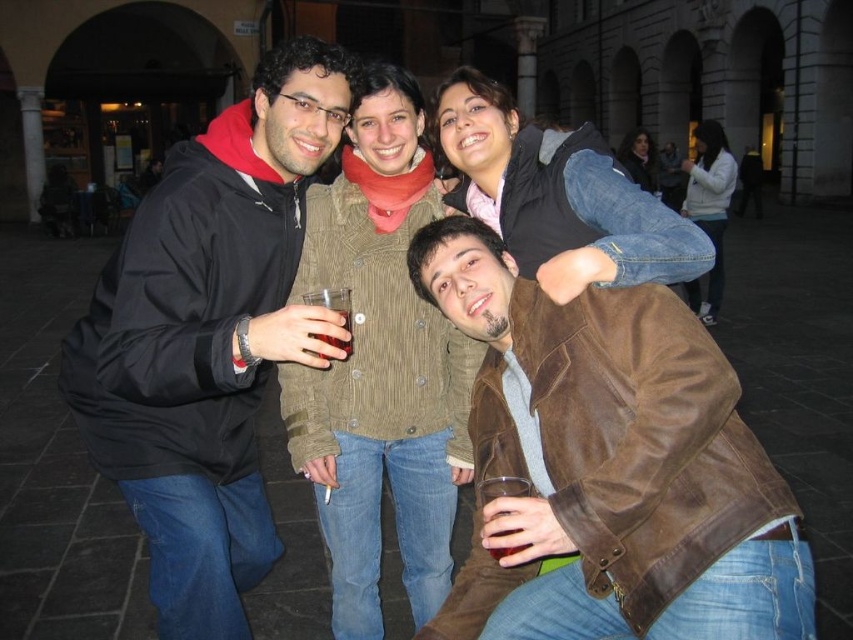
You are a photographer trying to capture the group photo. You notice the brown suede jacket at lower right and the translucent glass at center. Which object should you focus on first if you want to ensure both are in focus, considering their sizes?

The brown suede jacket at lower right is bigger than the translucent glass at center, so focusing on the larger object first will help ensure both are in focus.

You are standing at the center of the plaza and want to hand a gift to both the person wearing the brown suede jacket at lower right and the person wearing the black jacket at left. Which jacket is lower in position?

The brown suede jacket at lower right is below the black jacket at left, so the brown suede jacket at lower right is lower in position.

Looking at this image, you are standing at the center of the square and want to find the black jacket at left. Which direction should you look to locate it?

The black jacket at left is located at point (207, 337), so you should look to your left side to find it.